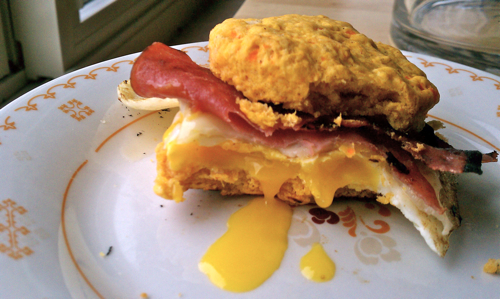
In order to click on window in this screenshot , I will do `click(95, 13)`.